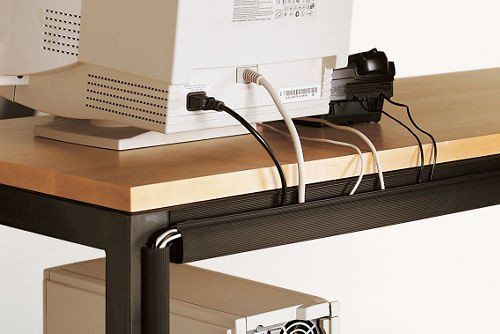
This screenshot has width=500, height=334. Find the location of `cords`. cords is located at coordinates (195, 112), (250, 78), (356, 99), (386, 98), (364, 132), (355, 145).